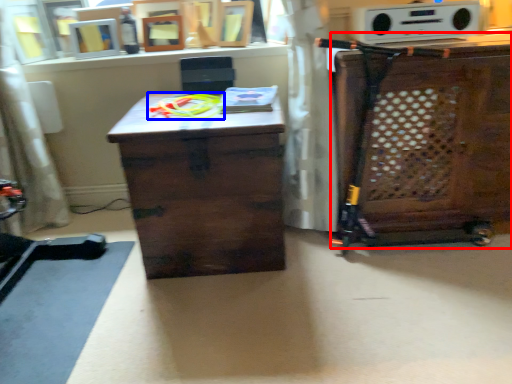
Question: Which of the following is the closest to the observer, cabinetry (highlighted by a red box) or toy (highlighted by a blue box)?

Choices:
 (A) cabinetry
 (B) toy

Answer: (A)